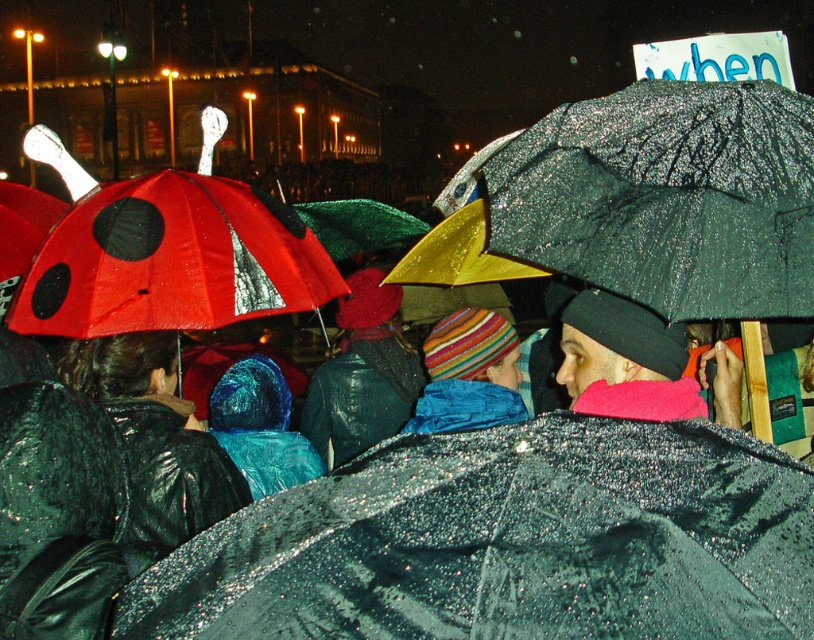
Question: Does shiny black umbrella at center appear on the right side of shiny blue jacket at center?

Choices:
 (A) yes
 (B) no

Answer: (A)

Question: Which point appears farthest from the camera in this image?

Choices:
 (A) (407, 420)
 (B) (324, 456)

Answer: (B)

Question: Which object is closer to the camera taking this photo?

Choices:
 (A) striped wool hat at center
 (B) shiny black umbrella at center
 (C) shiny black jacket at left
 (D) shiny blue jacket at center

Answer: (B)

Question: Does shiny black jacket at left lie in front of shiny blue jacket at center?

Choices:
 (A) yes
 (B) no

Answer: (A)

Question: Where is shiny black umbrella at center located in relation to shiny black jacket at left in the image?

Choices:
 (A) left
 (B) right

Answer: (B)

Question: Which point is farther to the camera?

Choices:
 (A) (154, 428)
 (B) (386, 406)
 (C) (466, 513)

Answer: (B)